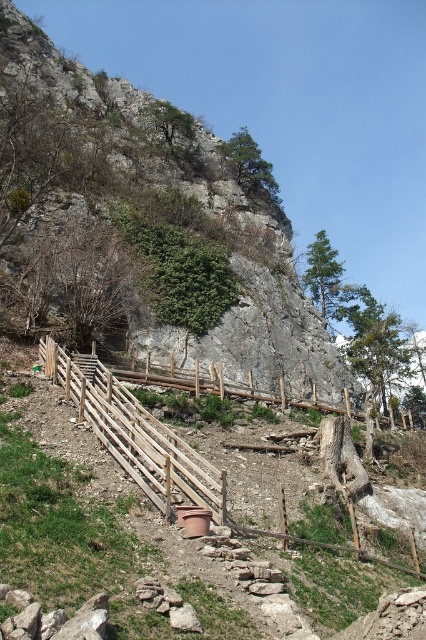
In the scene shown: You are standing at the base of the hill and looking up at the wooden staircase. There are two points marked on the slope, point (281, 236) and point (77, 403). Which point is closer to you?

Point (77, 403) is closer to you because it is less further to the camera than point (281, 236).